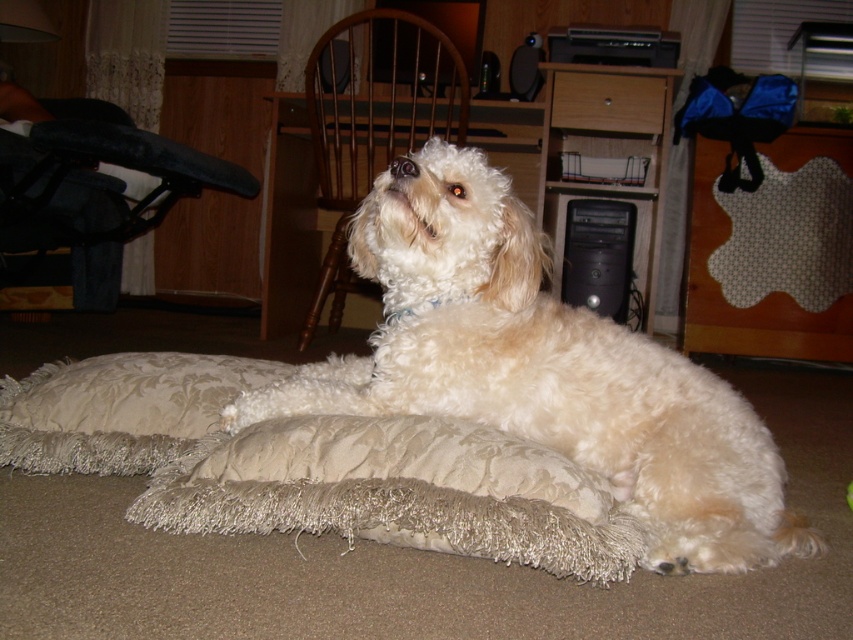
You are a delivery person who needs to place a small package on the desk in the image. The desk has limited space between the printer and the computer tower. Considering the size of the white fluffy dog at center and the beige shaggy pillow at lower center, which object should you avoid placing the package near to ensure it doesn t get knocked over?

The white fluffy dog at center is larger than the beige shaggy pillow at lower center, so you should avoid placing the package near the white fluffy dog at center to prevent it from being knocked over.

You are standing in a room and see a point marked at coordinates (543, 369). What object is located at that point?

The point at coordinates (543, 369) indicates the white fluffy dog at center.

You are taking a photo of the dog lying on the cushion in the home office. You want to focus on the point closer to the camera. Which point should you select between point (241, 440) and point (79, 422)?

You should select point (241, 440) because it is closer to the camera than point (79, 422).